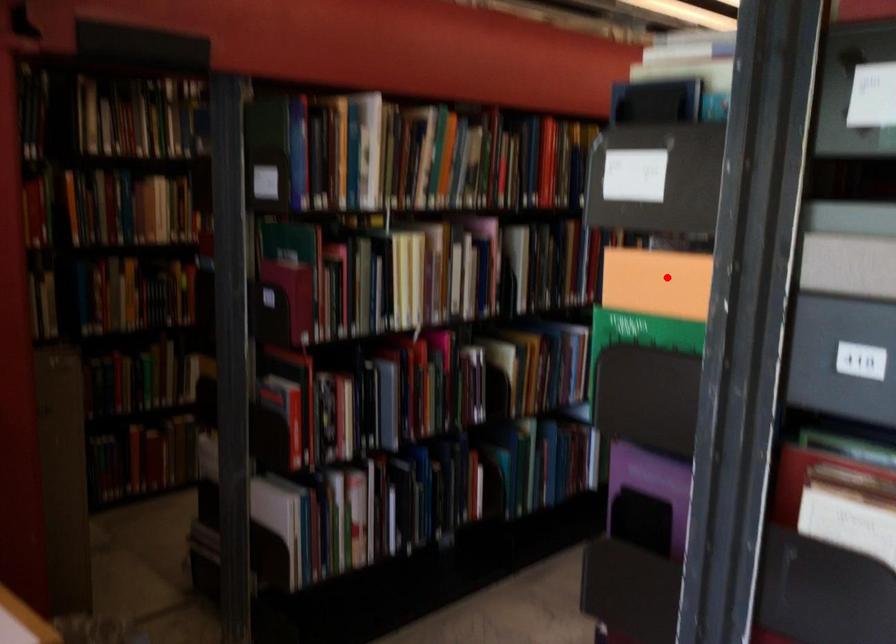
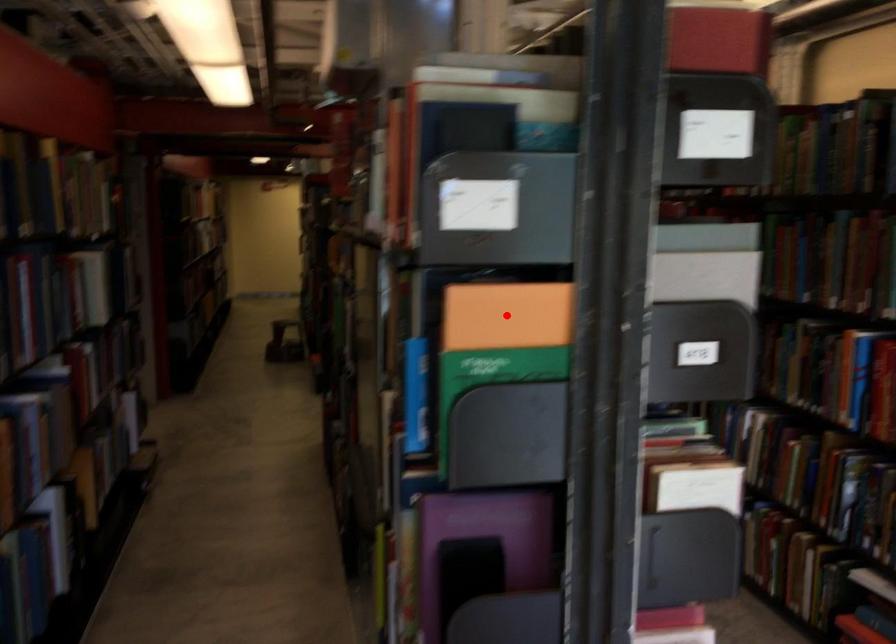
I am providing you with two images of the same scene from different viewpoints. A red point is marked on the first image and another point is marked on the second image. Does the point marked in image1 correspond to the same location as the one in image2?

Yes